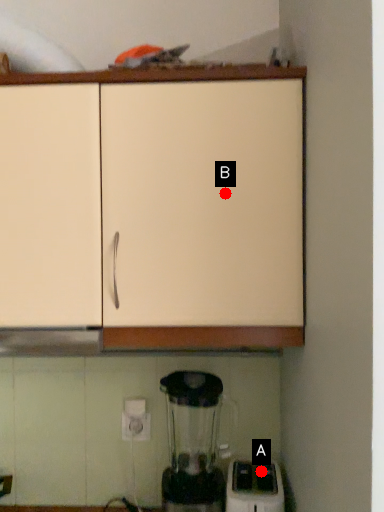
Question: Two points are circled on the image, labeled by A and B beside each circle. Which point is closer to the camera?

Choices:
 (A) A is closer
 (B) B is closer

Answer: (B)